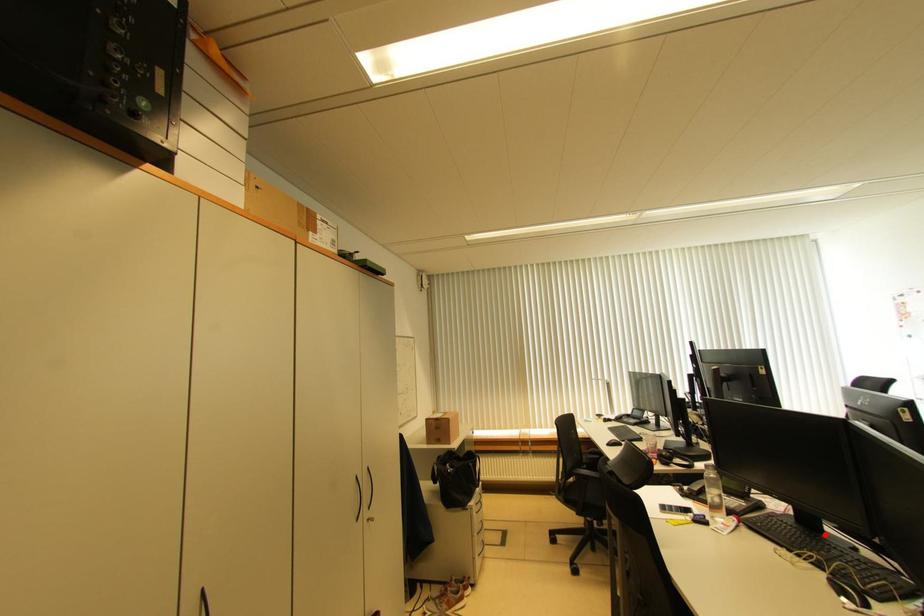
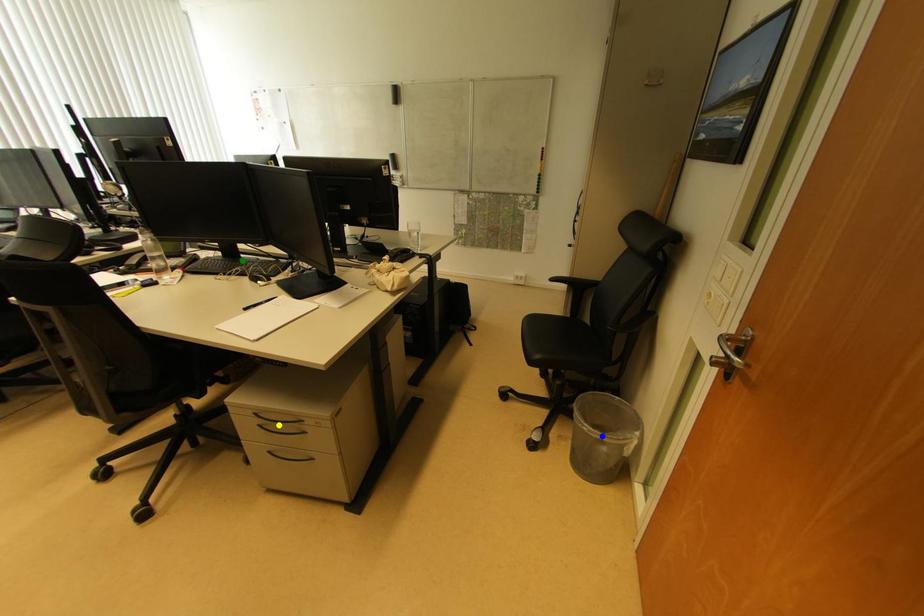
Question: I am providing you with two images of the same scene from different viewpoints. A red point is marked on the first image. You are given multiple points on the second image. Which point in image 2 represents the same 3d spot as the red point in image 1?

Choices:
 (A) green point
 (B) blue point
 (C) yellow point

Answer: (A)